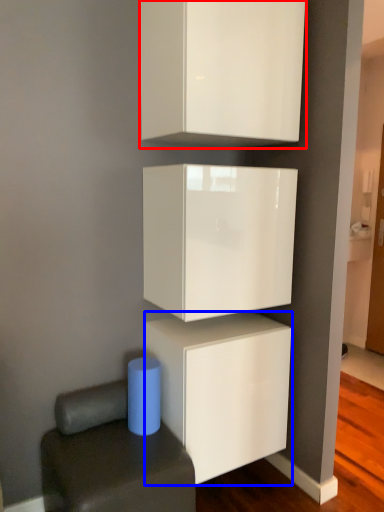
Question: Which point is closer to the camera, cabinetry (highlighted by a red box) or cabinetry (highlighted by a blue box)?

Choices:
 (A) cabinetry
 (B) cabinetry

Answer: (A)